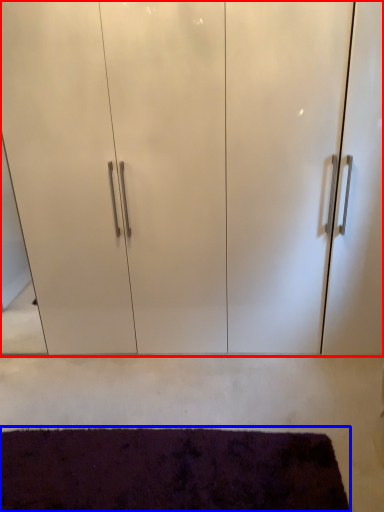
Question: Which of the following is the farthest to the observer, cupboard (highlighted by a red box) or mat (highlighted by a blue box)?

Choices:
 (A) cupboard
 (B) mat

Answer: (A)